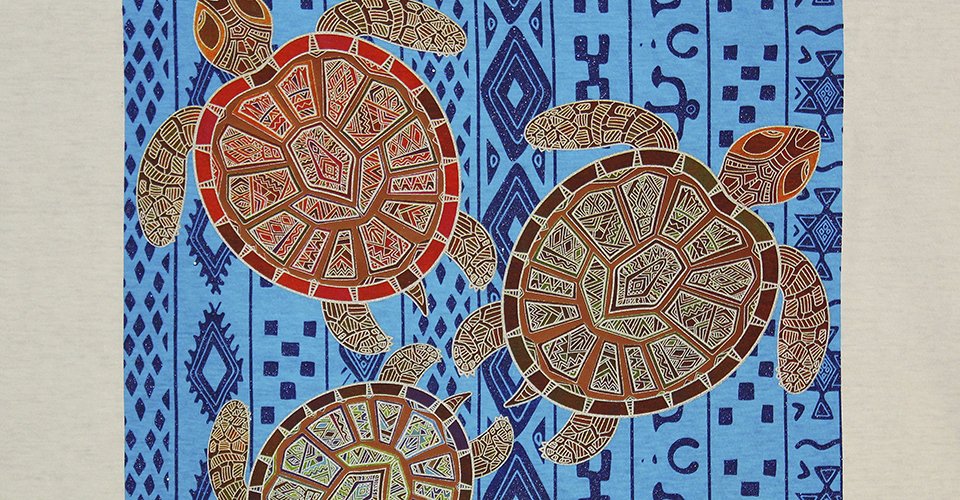
Locate an element on the screen. Image resolution: width=960 pixels, height=500 pixels. wall is located at coordinates (280, 342).